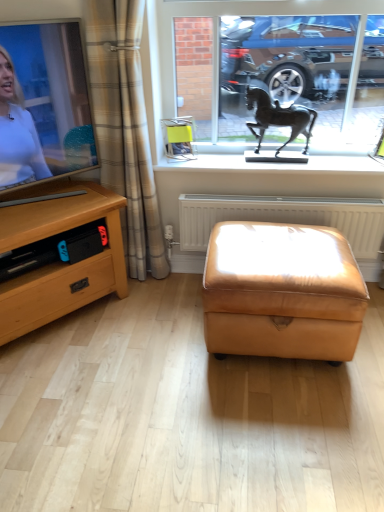
This screenshot has width=384, height=512. I want to click on vacant area situated below bronze horse at center (from a real-world perspective), so click(x=283, y=152).